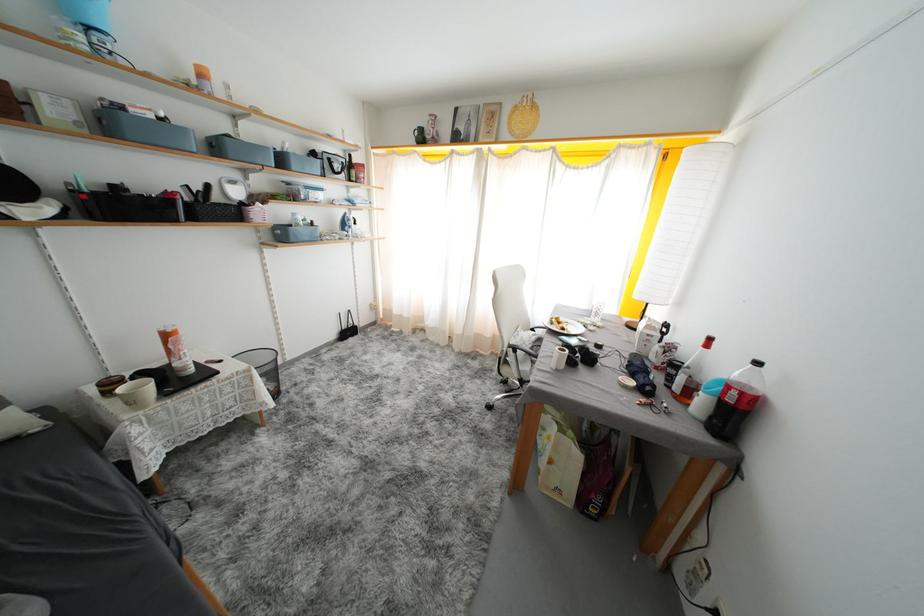
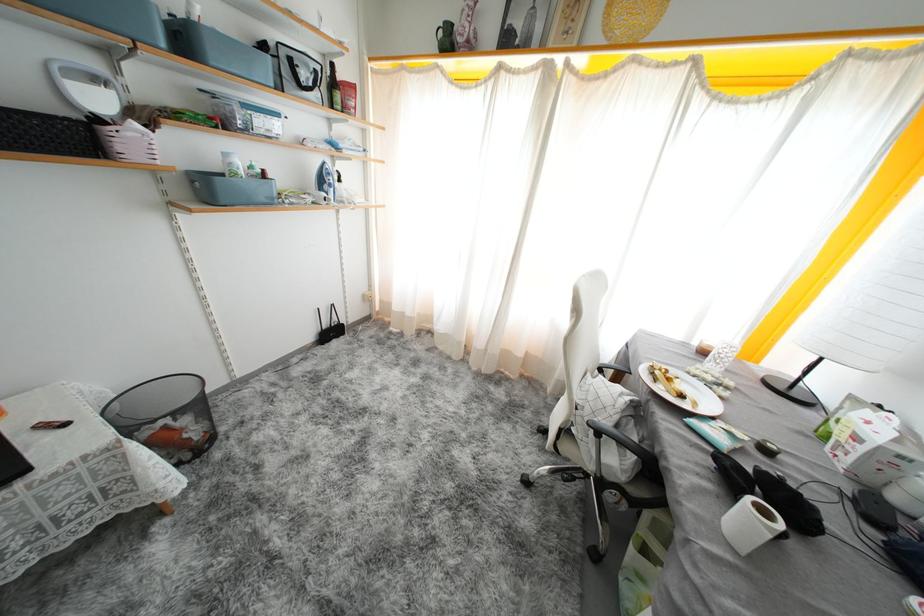
Find the pixel in the second image that matches (x=289, y=238) in the first image.

(215, 196)